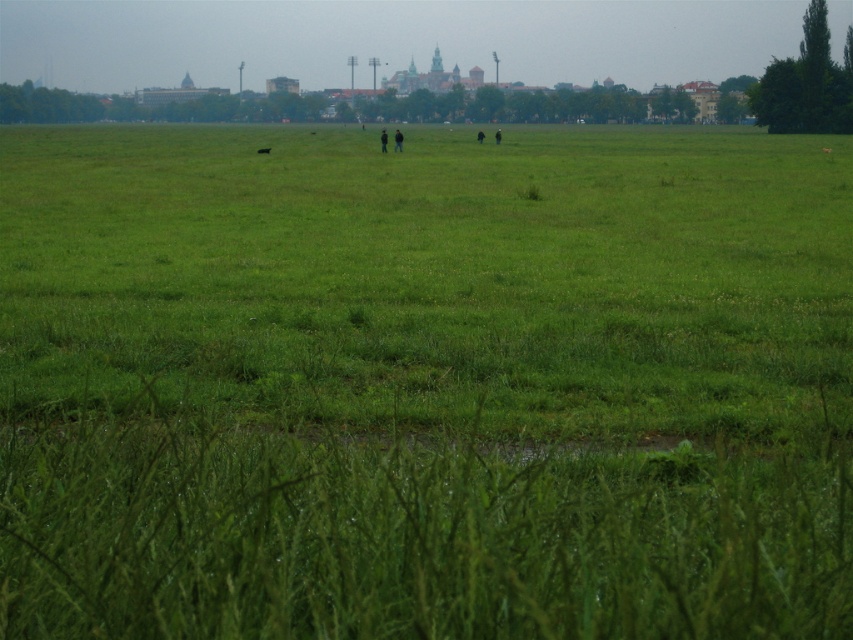
You are standing in the open grassy field and see the black matte person at center and the dark green grass at center. Which object is located above the other?

The black matte person at center is positioned under dark green grass at center, so the dark green grass at center is above the black matte person at center.